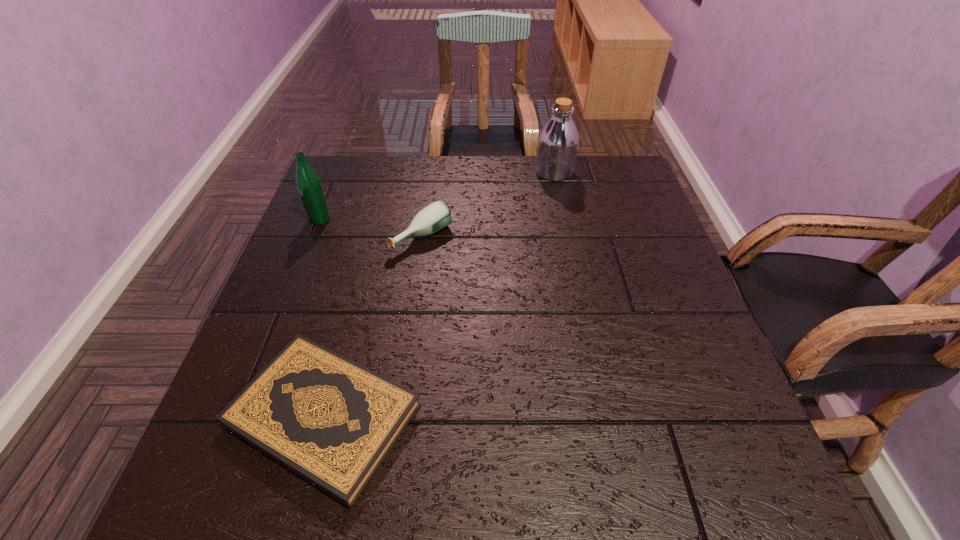
The height and width of the screenshot is (540, 960). I want to click on vacant space located 0.140m on the right of the nearest object, so (501, 416).

This screenshot has width=960, height=540. I want to click on object at the far edge, so click(558, 140).

Identify the location of object at the near edge. This screenshot has width=960, height=540. (331, 421).

In order to click on bottle that is at the left edge in this screenshot , I will do `click(308, 183)`.

What are the coordinates of `hardback book at the left edge` in the screenshot? It's located at (331, 421).

Image resolution: width=960 pixels, height=540 pixels. I want to click on object that is at the near left corner, so click(x=331, y=421).

I want to click on vacant space at the far edge, so click(473, 180).

This screenshot has height=540, width=960. Find the location of `vacant position at the left edge of the desktop`. vacant position at the left edge of the desktop is located at coordinates (339, 308).

Where is `free space at the right edge of the desktop`? The height and width of the screenshot is (540, 960). free space at the right edge of the desktop is located at coordinates (633, 340).

Where is `blank space at the far left corner`? Image resolution: width=960 pixels, height=540 pixels. blank space at the far left corner is located at coordinates (372, 163).